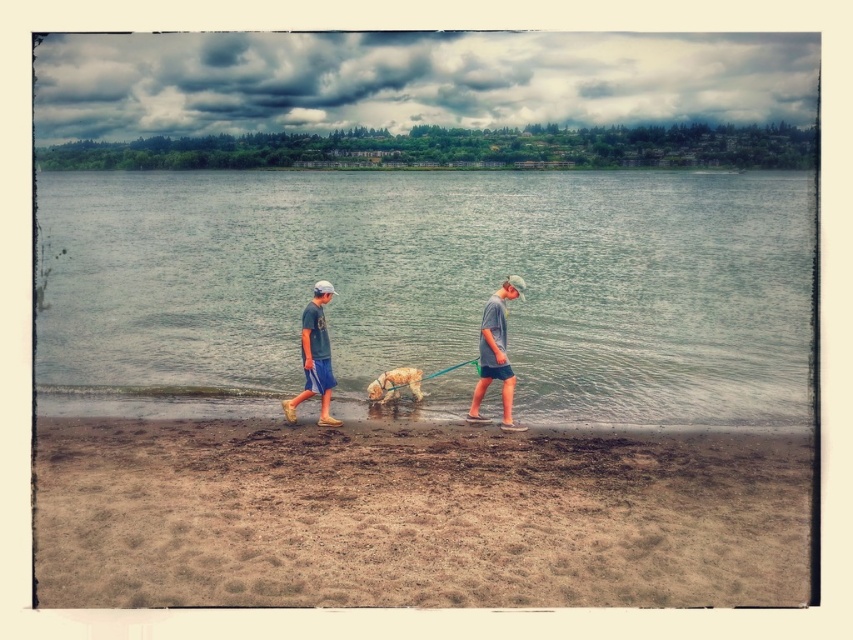
You are a photographer standing on the lakeside beach. You want to take a photo of the two people wearing gray matte shorts at center and matte blue shorts at center. If your camera has a maximum focus range of 1.5 meters, can you capture both subjects in focus without moving?

The gray matte shorts at center is 1.86 meters away from the matte blue shorts at center. Since the distance between them exceeds the camera maximum focus range of 1.5 meters, you cannot capture both subjects in focus without moving.

You are a photographer standing at the shoreline. You want to capture a photo of the gray matte shorts at center and the golden fur dog at center. Which object is positioned closer to your camera lens?

The gray matte shorts at center is closer to the viewer than the golden fur dog at center, so the gray matte shorts at center would appear closer to the camera lens in the photo.

You are planning to walk your dog near the clear water at center and the golden fur dog at center. Based on the scene, which area is wider for walking?

The clear water at center is wider than the golden fur dog at center, so the clear water at center is a better area for walking.